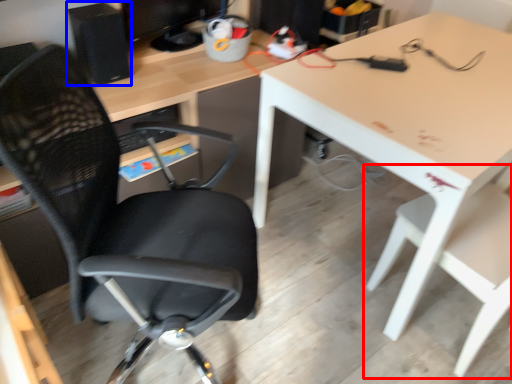
Question: Which object is further to the camera taking this photo, chair (highlighted by a red box) or computer tower (highlighted by a blue box)?

Choices:
 (A) chair
 (B) computer tower

Answer: (B)